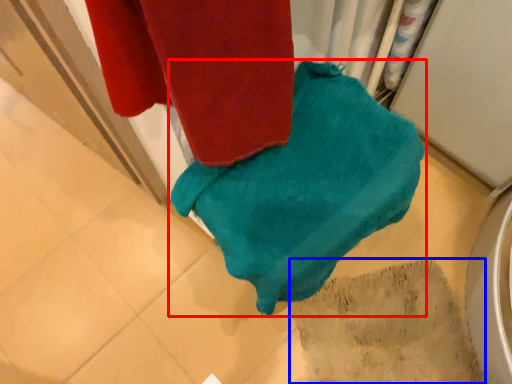
Question: Among these objects, which one is nearest to the camera, towel (highlighted by a red box) or tile (highlighted by a blue box)?

Choices:
 (A) towel
 (B) tile

Answer: (A)